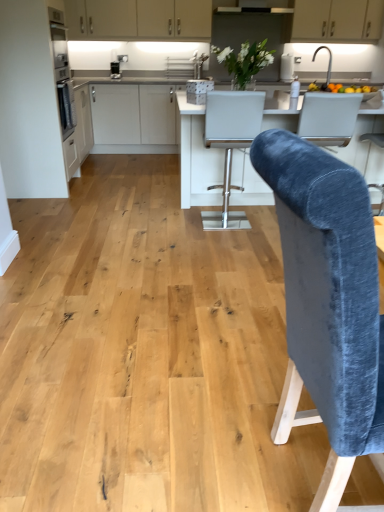
Find the location of `vacant area situated to the left side of velvet blue chair at center, marked as the first chair in a bottom-to-top arrangement`. vacant area situated to the left side of velvet blue chair at center, marked as the first chair in a bottom-to-top arrangement is located at coordinates (177, 444).